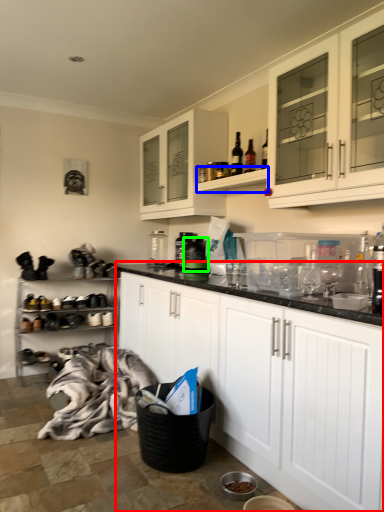
Question: Which object is the closest to the cabinetry (highlighted by a red box)? Choose among these: shelf (highlighted by a blue box) or appliance (highlighted by a green box).

Choices:
 (A) shelf
 (B) appliance

Answer: (A)